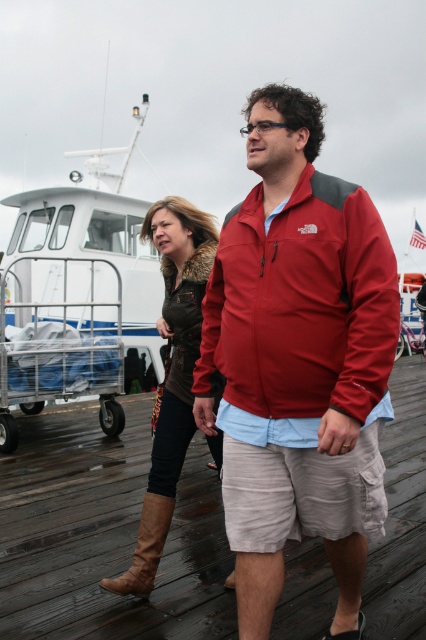
Question: Does red softshell jacket at center have a lesser width compared to brown suede boots at lower left?

Choices:
 (A) yes
 (B) no

Answer: (B)

Question: Which point is closer to the camera taking this photo?

Choices:
 (A) (187, 346)
 (B) (244, 396)
 (C) (285, 464)

Answer: (C)

Question: Based on their relative distances, which object is nearer to the red softshell jacket at center?

Choices:
 (A) brown suede boots at lower left
 (B) brown suede boot at lower left
 (C) matte red jacket at center

Answer: (C)

Question: Can you confirm if brown leather boots at lower left is wider than brown suede boot at lower left?

Choices:
 (A) yes
 (B) no

Answer: (A)

Question: Does brown leather boots at lower left have a lesser width compared to light beige cotton shorts at center?

Choices:
 (A) yes
 (B) no

Answer: (B)

Question: Among these points, which one is farthest from the camera?

Choices:
 (A) (391, 627)
 (B) (279, 342)
 (C) (380, 461)
 (D) (336, 477)

Answer: (A)